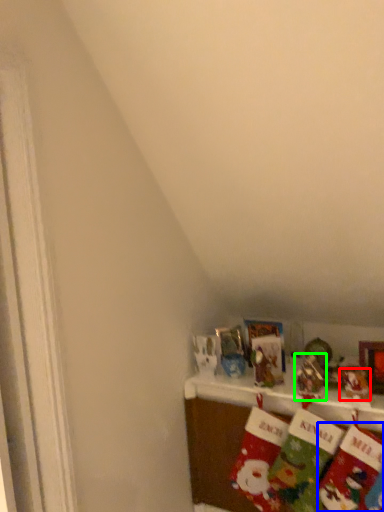
Question: Which object is positioned closest to toy (highlighted by a red box)? Select from sock (highlighted by a blue box) and toy (highlighted by a green box).

Choices:
 (A) sock
 (B) toy

Answer: (B)